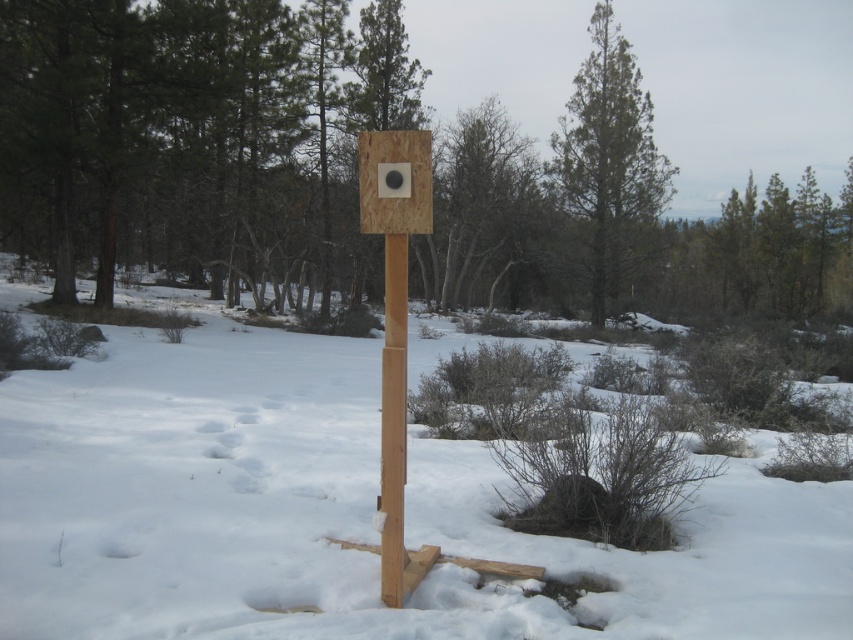
You are an archer preparing to shoot an arrow at the target board. You notice the white snow at center and the green coniferous tree at upper center. Which object is taller?

The green coniferous tree at upper center is taller than the white snow at center.

You are standing in front of the wooden target stand and want to place two markers at the coordinates point (387, 330) and point (360, 161). Which marker will appear closer to you when viewed from your current position?

Point (387, 330) is closer to the camera than point (360, 161), so the marker at point (387, 330) will appear closer to you.